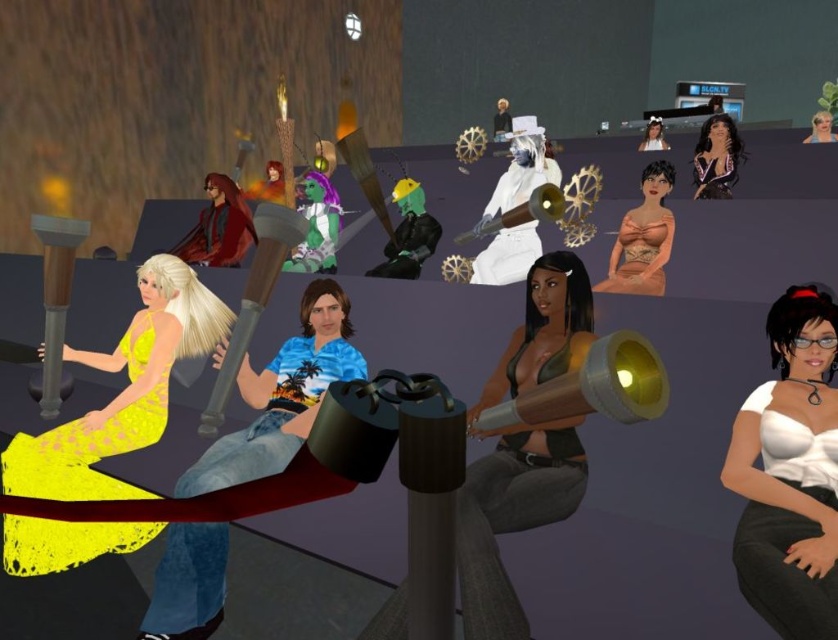
Is black matte tank top at center smaller than smooth blonde hair at upper right?

No.

Who is more forward, (577, 490) or (816, 134)?

Point (577, 490)

Identify the location of black matte tank top at center. (511, 516).

Which of these two, black matte tank top at center or shiny black dress at upper right, stands shorter?

shiny black dress at upper right

Consider the image. Between black matte tank top at center and shiny black dress at upper right, which one appears on the right side from the viewer's perspective?

shiny black dress at upper right is more to the right.

Which is in front, point (508, 584) or point (727, 147)?

Point (508, 584) is more forward.

The image size is (838, 640). Find the location of `black matte tank top at center`. black matte tank top at center is located at coordinates (511, 516).

Is yellow satin dress at center positioned in front of smooth white hair at upper right?

Yes, yellow satin dress at center is closer to the viewer.

Is point (328, 292) in front of point (649, 129)?

Yes.

At what (x,y) coordinates should I click in order to perform the action: click on yellow satin dress at center. Please return your answer as a coordinate pair (x, y). The width and height of the screenshot is (838, 640). Looking at the image, I should click on (282, 396).